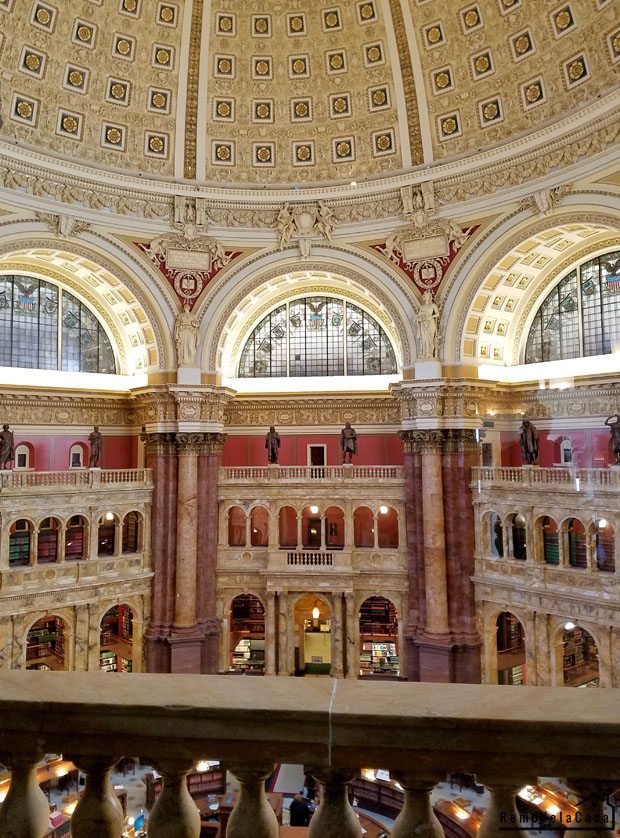
The width and height of the screenshot is (620, 838). I want to click on adorned ceiling, so click(x=278, y=86), click(x=89, y=55), click(x=534, y=53).